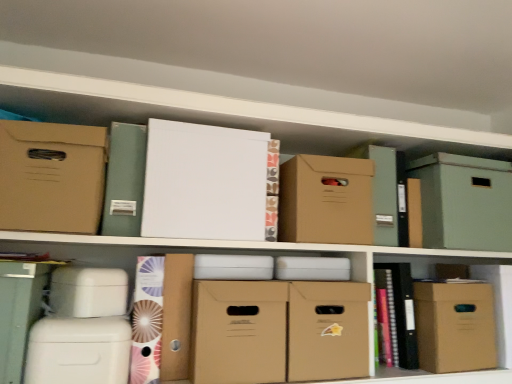
Question: Is matte cardboard box at lower right surrounding green cardboard box at upper right, the sixth cardboard box viewed from the left?

Choices:
 (A) no
 (B) yes

Answer: (A)

Question: Considering the relative sizes of matte cardboard box at lower right and green cardboard box at upper right, the sixth cardboard box viewed from the left, in the image provided, is matte cardboard box at lower right smaller than green cardboard box at upper right, the sixth cardboard box viewed from the left,?

Choices:
 (A) no
 (B) yes

Answer: (B)

Question: Is matte cardboard box at lower right positioned before green cardboard box at upper right, which is the second cardboard box in right-to-left order?

Choices:
 (A) yes
 (B) no

Answer: (A)

Question: Is matte cardboard box at lower right bigger than green cardboard box at upper right, the sixth cardboard box viewed from the left?

Choices:
 (A) yes
 (B) no

Answer: (B)

Question: From a real-world perspective, is matte cardboard box at lower right over green cardboard box at upper right, the sixth cardboard box viewed from the left?

Choices:
 (A) yes
 (B) no

Answer: (B)

Question: Does matte cardboard box at lower right have a lesser width compared to green cardboard box at upper right, which is the second cardboard box in right-to-left order?

Choices:
 (A) no
 (B) yes

Answer: (B)

Question: Is matte cardboard box at lower right not within matte green file at upper left, which is counted as the second book, starting from the bottom?

Choices:
 (A) no
 (B) yes

Answer: (B)

Question: Is matte cardboard box at lower right aimed at matte green file at upper left, the first book from the top?

Choices:
 (A) no
 (B) yes

Answer: (A)

Question: From the image's perspective, is matte cardboard box at lower right on top of matte green file at upper left, the first book from the top?

Choices:
 (A) yes
 (B) no

Answer: (B)

Question: Does matte cardboard box at lower right have a smaller size compared to matte green file at upper left, which is counted as the second book, starting from the bottom?

Choices:
 (A) no
 (B) yes

Answer: (A)

Question: Can you confirm if matte cardboard box at lower right is shorter than matte green file at upper left, which is counted as the second book, starting from the bottom?

Choices:
 (A) yes
 (B) no

Answer: (A)

Question: Is the position of matte cardboard box at lower right less distant than that of matte green file at upper left, which is counted as the second book, starting from the bottom?

Choices:
 (A) yes
 (B) no

Answer: (B)

Question: Does green cardboard box at upper right, which is the second cardboard box in right-to-left order, appear on the right side of matte cardboard box at lower right?

Choices:
 (A) yes
 (B) no

Answer: (A)